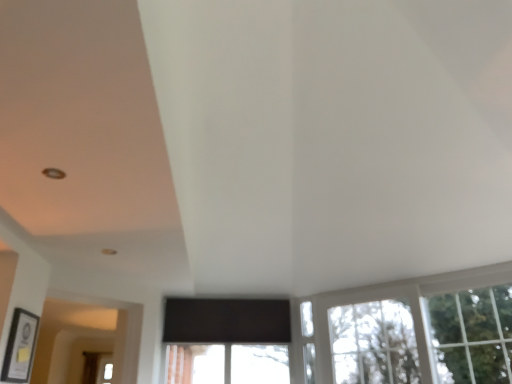
Locate an element on the screen. This screenshot has width=512, height=384. matte black picture frame at lower left is located at coordinates (20, 347).

What are the coordinates of `green leafy tree at upper right` in the screenshot? It's located at (471, 335).

Is green leafy tree at upper right with matte black picture frame at lower left?

No, green leafy tree at upper right is not making contact with matte black picture frame at lower left.

Which of these two, green leafy tree at upper right or matte black picture frame at lower left, is wider?

With larger width is green leafy tree at upper right.

Can you confirm if green leafy tree at upper right is positioned to the left of matte black picture frame at lower left?

No, green leafy tree at upper right is not to the left of matte black picture frame at lower left.

This screenshot has width=512, height=384. I want to click on tree above the matte black picture frame at lower left (from a real-world perspective), so click(x=471, y=335).

Which of these two, clear glass window at lower right or green leafy tree at upper right, stands taller?

With more height is green leafy tree at upper right.

Which object is positioned more to the right, clear glass window at lower right or green leafy tree at upper right?

From the viewer's perspective, green leafy tree at upper right appears more on the right side.

Is clear glass window at lower right not near green leafy tree at upper right?

No, clear glass window at lower right is not far from green leafy tree at upper right.

Is the depth of green leafy tree at upper right greater than that of clear glass window at lower right?

No, green leafy tree at upper right is in front of clear glass window at lower right.

From the picture: Looking at their sizes, would you say green leafy tree at upper right is wider or thinner than clear glass window at lower right?

Considering their sizes, green leafy tree at upper right looks slimmer than clear glass window at lower right.

Consider the image. From the image's perspective, is green leafy tree at upper right located above clear glass window at lower right?

Yes, from the image's perspective, green leafy tree at upper right is on top of clear glass window at lower right.

Is green leafy tree at upper right inside or outside of clear glass window at lower right?

green leafy tree at upper right is spatially positioned inside clear glass window at lower right.

Is clear glass window at lower right with matte black picture frame at lower left?

No, clear glass window at lower right is not touching matte black picture frame at lower left.

From a real-world perspective, is clear glass window at lower right physically above matte black picture frame at lower left?

Indeed, from a real-world perspective, clear glass window at lower right stands above matte black picture frame at lower left.

Does point (389, 318) come in front of point (22, 329)?

No, (389, 318) is further to viewer.

Can you confirm if matte black picture frame at lower left is taller than green leafy tree at upper right?

No, matte black picture frame at lower left is not taller than green leafy tree at upper right.

Locate an element on the screen. The image size is (512, 384). picture frame lying above the green leafy tree at upper right (from the image's perspective) is located at coordinates pyautogui.click(x=20, y=347).

Based on their positions, is matte black picture frame at lower left located to the left or right of green leafy tree at upper right?

In the image, matte black picture frame at lower left appears on the left side of green leafy tree at upper right.

Which of these two, matte black picture frame at lower left or green leafy tree at upper right, is smaller?

Smaller between the two is matte black picture frame at lower left.

Can you confirm if matte black picture frame at lower left is bigger than clear glass window at lower right?

Actually, matte black picture frame at lower left might be smaller than clear glass window at lower right.

Is matte black picture frame at lower left aimed at clear glass window at lower right?

Yes, matte black picture frame at lower left is turned towards clear glass window at lower right.

What's the angular difference between matte black picture frame at lower left and clear glass window at lower right's facing directions?

matte black picture frame at lower left and clear glass window at lower right are facing 133 degrees away from each other.

Is matte black picture frame at lower left positioned beyond the bounds of clear glass window at lower right?

Yes, matte black picture frame at lower left is not within clear glass window at lower right.

The image size is (512, 384). What are the coordinates of `picture frame that is in front of the green leafy tree at upper right` in the screenshot? It's located at (20, 347).

Where is `window on the left of green leafy tree at upper right`? The height and width of the screenshot is (384, 512). window on the left of green leafy tree at upper right is located at coordinates click(374, 343).

Based on their spatial positions, is matte black picture frame at lower left or clear glass window at lower right closer to green leafy tree at upper right?

clear glass window at lower right.

Considering their positions, is green leafy tree at upper right positioned further to clear glass window at lower right than matte black picture frame at lower left?

Among the two, matte black picture frame at lower left is located further to clear glass window at lower right.

Which object lies nearer to the anchor point green leafy tree at upper right, clear glass window at lower right or matte black picture frame at lower left?

Based on the image, clear glass window at lower right appears to be nearer to green leafy tree at upper right.

Which object lies further to the anchor point matte black picture frame at lower left, clear glass window at lower right or green leafy tree at upper right?

Based on the image, green leafy tree at upper right appears to be further to matte black picture frame at lower left.

From the image, which object appears to be farther from matte black picture frame at lower left, green leafy tree at upper right or clear glass window at lower right?

The object further to matte black picture frame at lower left is green leafy tree at upper right.

Which object lies nearer to the anchor point clear glass window at lower right, matte black picture frame at lower left or green leafy tree at upper right?

Based on the image, green leafy tree at upper right appears to be nearer to clear glass window at lower right.

Where is `window located between matte black picture frame at lower left and green leafy tree at upper right in the left-right direction`? window located between matte black picture frame at lower left and green leafy tree at upper right in the left-right direction is located at coordinates (374, 343).